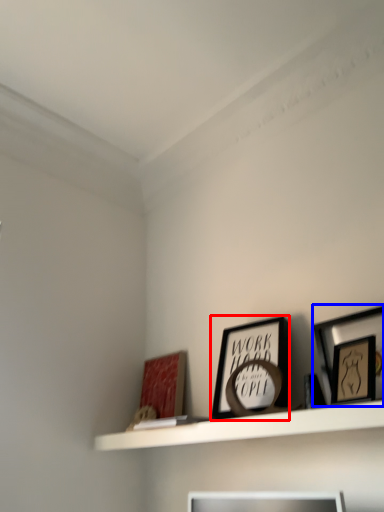
Question: Which point is closer to the camera, picture frame (highlighted by a red box) or picture frame (highlighted by a blue box)?

Choices:
 (A) picture frame
 (B) picture frame

Answer: (B)